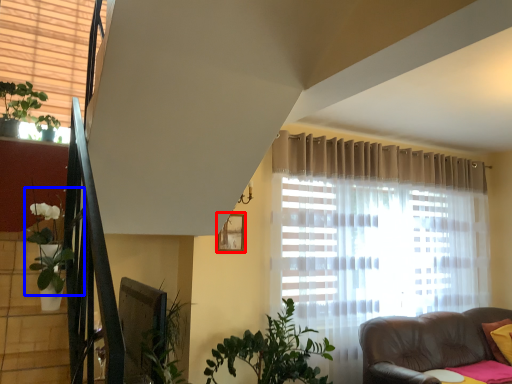
Question: Which object appears farthest to the camera in this image, picture frame (highlighted by a red box) or plant (highlighted by a blue box)?

Choices:
 (A) picture frame
 (B) plant

Answer: (A)